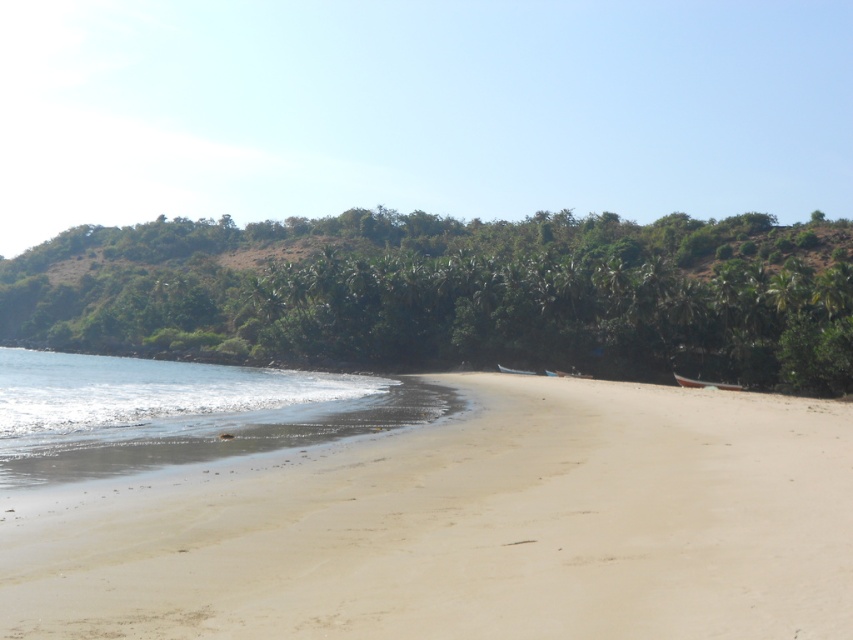
Between light beige sand at lower left and clear water at lower left, which one is positioned lower?

Positioned lower is clear water at lower left.

How much distance is there between light beige sand at lower left and clear water at lower left?

A distance of 15.95 meters exists between light beige sand at lower left and clear water at lower left.

The width and height of the screenshot is (853, 640). Identify the location of light beige sand at lower left. (468, 528).